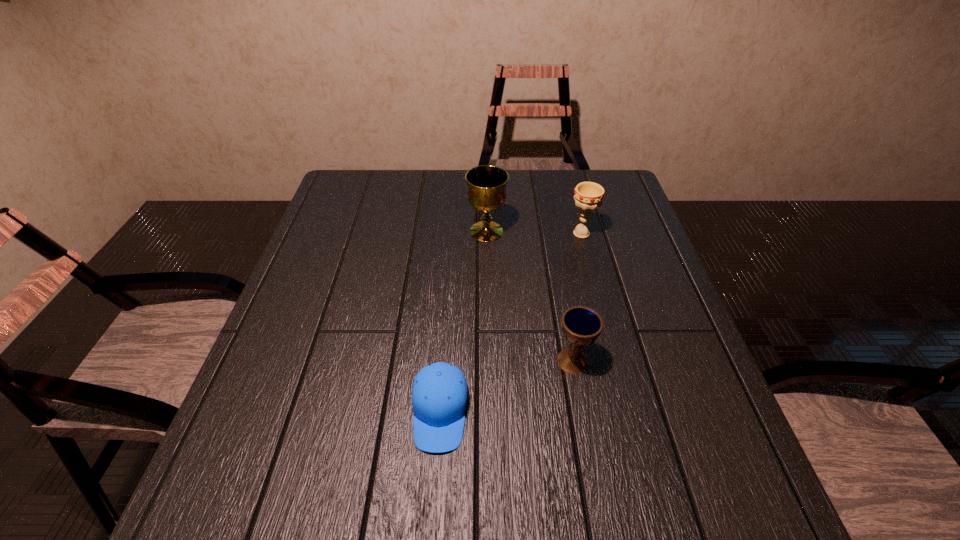
Where is `the leftmost chalice`? The height and width of the screenshot is (540, 960). the leftmost chalice is located at coordinates (487, 184).

This screenshot has height=540, width=960. Find the location of `the tallest object`. the tallest object is located at coordinates (487, 184).

What are the coordinates of `the rightmost object` in the screenshot? It's located at (588, 196).

The width and height of the screenshot is (960, 540). I want to click on the third object from left to right, so click(x=581, y=326).

The image size is (960, 540). What are the coordinates of `the nearest chalice` in the screenshot? It's located at (581, 326).

Where is `cap`? cap is located at coordinates (439, 397).

Find the location of `blank area located 0.240m on the back of the tallest chalice`. blank area located 0.240m on the back of the tallest chalice is located at coordinates (486, 176).

The image size is (960, 540). In order to click on free space located on the back of the rightmost object in this screenshot , I will do `click(567, 180)`.

The height and width of the screenshot is (540, 960). In order to click on vacant area located on the back of the second chalice from left to right in this screenshot , I will do `click(563, 305)`.

Find the location of a particular element. The image size is (960, 540). vacant position located on the front-facing side of the shortest object is located at coordinates pyautogui.click(x=435, y=490).